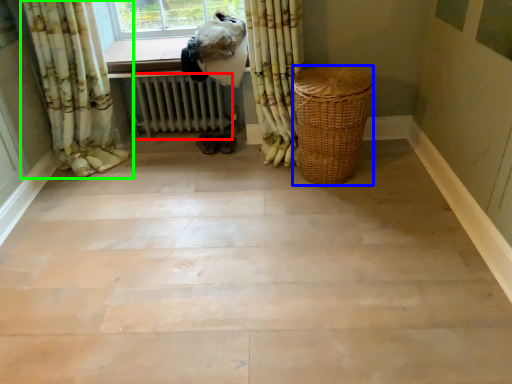
Question: Which object is positioned closest to radiator (highlighted by a red box)? Select from basket (highlighted by a blue box) and curtain (highlighted by a green box).

Choices:
 (A) basket
 (B) curtain

Answer: (B)